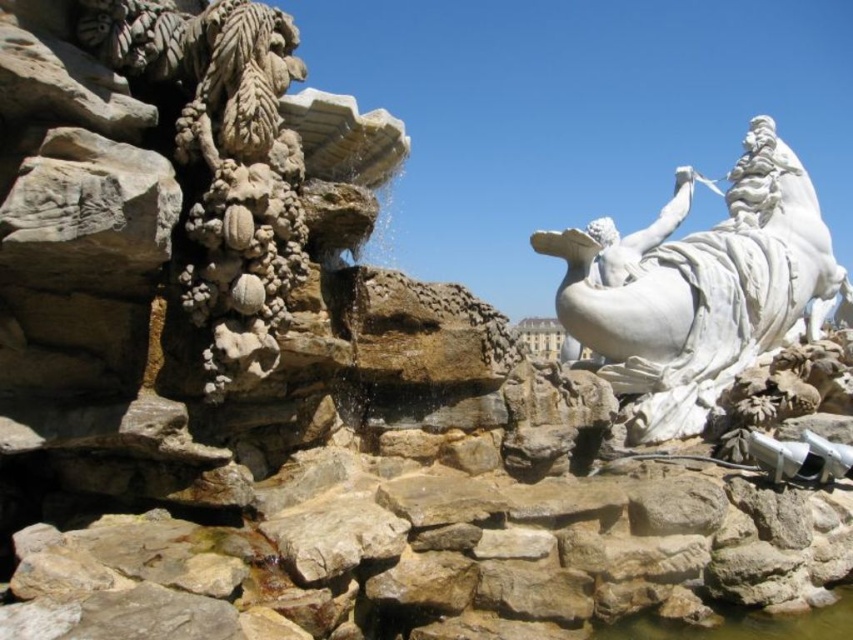
Between point (757, 317) and point (799, 634), which one is positioned in front?

Positioned in front is point (799, 634).

Can you confirm if white marble statue at right is shorter than clear water at rock bottom?

No.

The width and height of the screenshot is (853, 640). What do you see at coordinates (704, 292) in the screenshot? I see `white marble statue at right` at bounding box center [704, 292].

This screenshot has height=640, width=853. In order to click on white marble statue at right in this screenshot , I will do point(704,292).